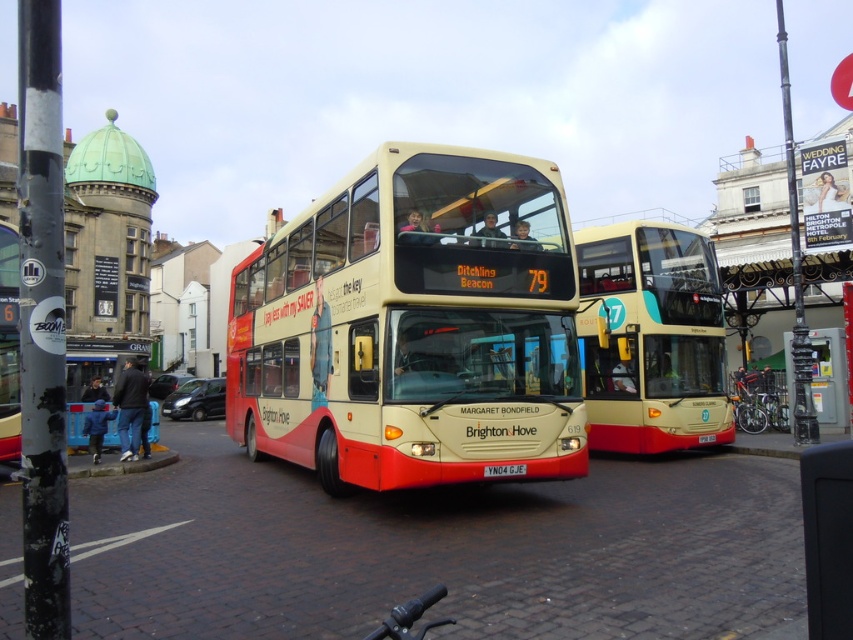
Can you confirm if beige matte double-decker bus at center is positioned above dark blue jeans at lower left?

Yes, beige matte double-decker bus at center is above dark blue jeans at lower left.

In the scene shown: Is beige matte double-decker bus at center to the left of dark blue jeans at lower left from the viewer's perspective?

No, beige matte double-decker bus at center is not to the left of dark blue jeans at lower left.

Which is behind, point (556, 355) or point (88, 413)?

Point (88, 413)

At what (x,y) coordinates should I click in order to perform the action: click on beige matte double-decker bus at center. Please return your answer as a coordinate pair (x, y). The image size is (853, 640). Looking at the image, I should click on pyautogui.click(x=413, y=326).

Based on the photo, is beige glossy bus at center positioned before dark blue jeans at lower left?

Yes, beige glossy bus at center is in front of dark blue jeans at lower left.

Can you confirm if beige glossy bus at center is positioned below dark blue jeans at lower left?

No.

Between point (637, 321) and point (117, 422), which one is positioned behind?

Point (117, 422)

At what (x,y) coordinates should I click in order to perform the action: click on beige glossy bus at center. Please return your answer as a coordinate pair (x, y). Looking at the image, I should click on (651, 339).

Is point (523, 156) closer to camera compared to point (517, 468)?

No, it is not.

Could you measure the distance between beige matte double-decker bus at center and yellow metallic license plate at center?

The distance of beige matte double-decker bus at center from yellow metallic license plate at center is 10.62 feet.

The image size is (853, 640). In order to click on beige matte double-decker bus at center in this screenshot , I will do `click(413, 326)`.

You are a GUI agent. You are given a task and a screenshot of the screen. Output one action in this format:
    pyautogui.click(x=<x>, y=<y>)
    Task: Click on the beige matte double-decker bus at center
    This screenshot has width=853, height=640.
    Given the screenshot: What is the action you would take?
    pyautogui.click(x=413, y=326)